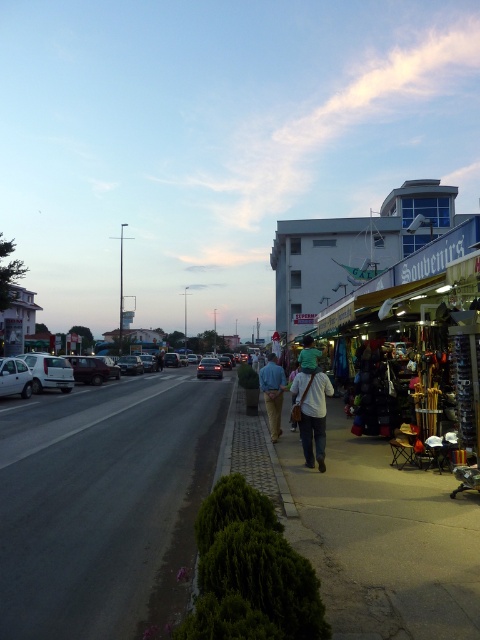
Question: Is dark asphalt road at lower left wider than white cotton shirt at center?

Choices:
 (A) no
 (B) yes

Answer: (B)

Question: Which point is closer to the camera taking this photo?

Choices:
 (A) (x=4, y=417)
 (B) (x=279, y=424)

Answer: (B)

Question: Which object is closer to the camera taking this photo?

Choices:
 (A) matte black car at center
 (B) blue cotton shirt at center

Answer: (B)

Question: Which object is closer to the camera taking this photo?

Choices:
 (A) blue cotton shirt at center
 (B) white matte car at left

Answer: (A)

Question: Is matte black car at center bigger than white matte car at left?

Choices:
 (A) no
 (B) yes

Answer: (B)

Question: Can you confirm if dark asphalt road at lower left is positioned above white matte car at left?

Choices:
 (A) no
 (B) yes

Answer: (A)